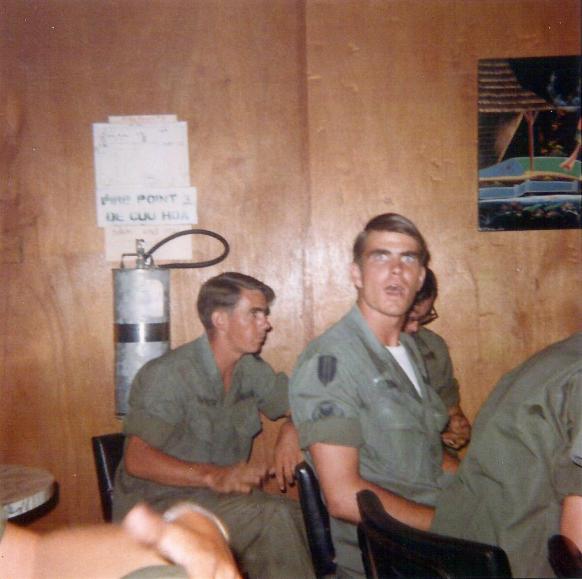
Locate an element on the screen. Image resolution: width=582 pixels, height=579 pixels. wall is located at coordinates (470, 337).